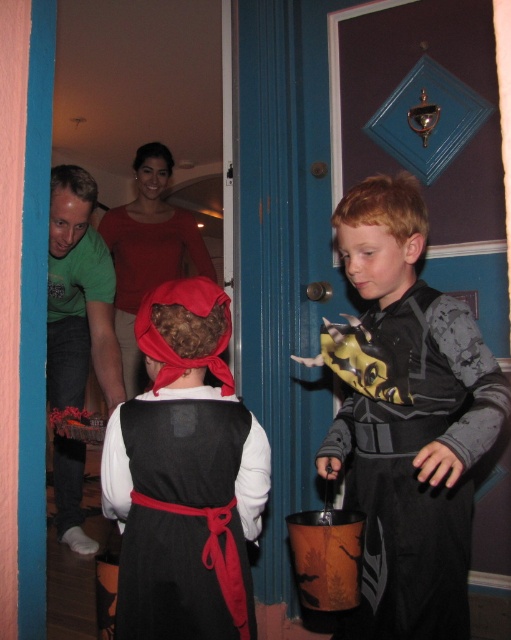
Between point (392, 177) and point (238, 477), which one is positioned in front?

Positioned in front is point (238, 477).

Does black matte costume at center have a greater width compared to velvet black dress at center?

Indeed, black matte costume at center has a greater width compared to velvet black dress at center.

I want to click on black matte costume at center, so click(410, 424).